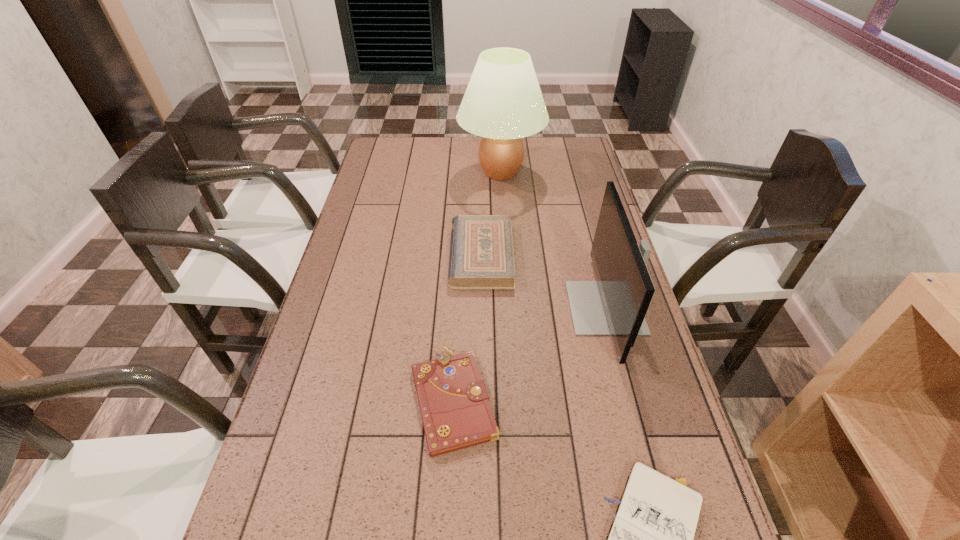
This screenshot has width=960, height=540. Identify the location of vacant space located 0.190m on the screen of the second tallest object. (504, 308).

You are a GUI agent. You are given a task and a screenshot of the screen. Output one action in this format:
    pyautogui.click(x=<x>, y=<y>)
    Task: Click on the free region located 0.290m on the screen of the second tallest object
    Image resolution: width=960 pixels, height=540 pixels.
    Given the screenshot: What is the action you would take?
    pyautogui.click(x=468, y=308)

This screenshot has height=540, width=960. What are the coordinates of `free space located on the spine side of the Bible` in the screenshot? It's located at (397, 255).

Where is `vacant region located 0.340m on the spine side of the Bible`? This screenshot has height=540, width=960. vacant region located 0.340m on the spine side of the Bible is located at coordinates (345, 255).

The width and height of the screenshot is (960, 540). Find the location of `free space located on the spine side of the Bible`. free space located on the spine side of the Bible is located at coordinates [x=392, y=255].

The image size is (960, 540). I want to click on free region located on the right of the left notebook, so coord(660,399).

Image resolution: width=960 pixels, height=540 pixels. I want to click on object located at the far edge, so click(503, 103).

Find the location of `object situated at the right edge`. object situated at the right edge is located at coordinates (616, 304).

The height and width of the screenshot is (540, 960). I want to click on vacant area at the far edge of the desktop, so click(x=471, y=144).

The height and width of the screenshot is (540, 960). In the image, there is a desktop. Find the location of `vacant area at the left edge`. vacant area at the left edge is located at coordinates click(x=346, y=402).